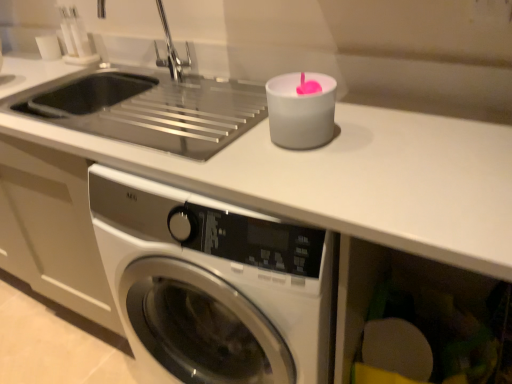
Find the location of a particular element. Image resolution: width=512 pixels, height=384 pixels. silver metallic faucet at upper left is located at coordinates (170, 50).

In order to face matte plastic sponge at lower right, should I rotate leftwards or rightwards?

To align with it, rotate right about 20.956°.

This screenshot has height=384, width=512. I want to click on matte plastic sponge at lower right, so click(x=422, y=315).

At what (x,y) coordinates should I click in order to perform the action: click on white matte candle at upper right. Please return your answer as a coordinate pair (x, y). Image resolution: width=512 pixels, height=384 pixels. Looking at the image, I should click on (301, 109).

Is matte plastic sponge at lower right far from white matte candle at upper right?

No, there isn't a large distance between matte plastic sponge at lower right and white matte candle at upper right.

Where is `candle holder above the matte plastic sponge at lower right (from a real-world perspective)`? This screenshot has height=384, width=512. candle holder above the matte plastic sponge at lower right (from a real-world perspective) is located at coordinates (301, 109).

Does point (339, 348) appear closer or farther from the camera than point (288, 134)?

Clearly, point (339, 348) is more distant from the camera than point (288, 134).

From the image's perspective, is white matte candle at upper right under matte plastic sponge at lower right?

No, from the image's perspective, white matte candle at upper right is not below matte plastic sponge at lower right.

Choose the correct answer: Is white matte candle at upper right inside matte plastic sponge at lower right or outside it?

white matte candle at upper right exists outside the volume of matte plastic sponge at lower right.

Which object is thinner, white matte candle at upper right or matte plastic sponge at lower right?

Thinner between the two is white matte candle at upper right.

Which is closer to the camera, (328,103) or (448,370)?

The point (328,103) is closer.

Is silver metallic faucet at upper left far away from matte plastic sponge at lower right?

Yes.

Is matte plastic sponge at lower right at the back of silver metallic faucet at upper left?

silver metallic faucet at upper left is not turned away from matte plastic sponge at lower right.

In the scene shown: Which is correct: silver metallic faucet at upper left is inside matte plastic sponge at lower right, or outside of it?

silver metallic faucet at upper left exists outside the volume of matte plastic sponge at lower right.

Is silver metallic faucet at upper left wider or thinner than matte plastic sponge at lower right?

Clearly, silver metallic faucet at upper left has less width compared to matte plastic sponge at lower right.

How much distance is there between white matte candle at upper right and silver metallic faucet at upper left?

white matte candle at upper right and silver metallic faucet at upper left are 26.37 inches apart from each other.

Which object is closer to the camera taking this photo, white matte candle at upper right or silver metallic faucet at upper left?

white matte candle at upper right is in front.

This screenshot has width=512, height=384. In order to click on faucet above the white matte candle at upper right (from the image's perspective) in this screenshot , I will do `click(170, 50)`.

Is white matte counter top at upper center outside of white matte candle at upper right?

Yes.

Considering the relative sizes of white matte counter top at upper center and white matte candle at upper right in the image provided, is white matte counter top at upper center bigger than white matte candle at upper right?

Correct, white matte counter top at upper center is larger in size than white matte candle at upper right.

Is white matte counter top at upper center not near white matte candle at upper right?

No, there isn't a large distance between white matte counter top at upper center and white matte candle at upper right.

Measure the distance from white matte counter top at upper center to white matte candle at upper right.

A distance of 6.93 inches exists between white matte counter top at upper center and white matte candle at upper right.

From a real-world perspective, between matte plastic sponge at lower right and silver metallic faucet at upper left, who is vertically lower?

In real-world perspective, matte plastic sponge at lower right is lower.

Considering their positions, is matte plastic sponge at lower right located in front of or behind silver metallic faucet at upper left?

matte plastic sponge at lower right is positioned closer to the viewer than silver metallic faucet at upper left.

In terms of width, does matte plastic sponge at lower right look wider or thinner when compared to silver metallic faucet at upper left?

In the image, matte plastic sponge at lower right appears to be wider than silver metallic faucet at upper left.

Does matte plastic sponge at lower right touch silver metallic faucet at upper left?

No.

Is the position of white matte counter top at upper center less distant than that of matte plastic sponge at lower right?

Yes, white matte counter top at upper center is closer to the viewer.

Based on the photo, can you confirm if white matte counter top at upper center is positioned to the left of matte plastic sponge at lower right?

Correct, you'll find white matte counter top at upper center to the left of matte plastic sponge at lower right.

From a real-world perspective, is white matte counter top at upper center physically above matte plastic sponge at lower right?

Yes, from a real-world perspective, white matte counter top at upper center is on top of matte plastic sponge at lower right.

Locate an element on the screen. The width and height of the screenshot is (512, 384). candle holder above the matte plastic sponge at lower right (from a real-world perspective) is located at coordinates (301, 109).

Identify the location of drawer below the white matte candle at upper right (from a real-world perspective). (422, 315).

Estimate the real-world distances between objects in this image. Which object is closer to white matte counter top at upper center, matte plastic sponge at lower right or white matte candle at upper right?

white matte candle at upper right lies closer to white matte counter top at upper center than the other object.

When comparing their distances from matte plastic sponge at lower right, does white matte counter top at upper center or white matte candle at upper right seem closer?

The object closer to matte plastic sponge at lower right is white matte counter top at upper center.

Considering their positions, is silver metallic faucet at upper left positioned further to white matte counter top at upper center than white matte candle at upper right?

silver metallic faucet at upper left is further to white matte counter top at upper center.

Consider the image. From the image, which object appears to be nearer to silver metallic faucet at upper left, white matte candle at upper right or white matte counter top at upper center?

white matte candle at upper right.

From the image, which object appears to be farther from silver metallic faucet at upper left, matte plastic sponge at lower right or white matte candle at upper right?

The object further to silver metallic faucet at upper left is matte plastic sponge at lower right.

Which object lies nearer to the anchor point matte plastic sponge at lower right, white matte candle at upper right or silver metallic faucet at upper left?

The object closer to matte plastic sponge at lower right is white matte candle at upper right.

From the image, which object appears to be farther from silver metallic faucet at upper left, white matte counter top at upper center or matte plastic sponge at lower right?

Among the two, matte plastic sponge at lower right is located further to silver metallic faucet at upper left.

Looking at the image, which one is located further to white matte candle at upper right, silver metallic faucet at upper left or matte plastic sponge at lower right?

silver metallic faucet at upper left is positioned further to the anchor white matte candle at upper right.

The height and width of the screenshot is (384, 512). Identify the location of candle holder between silver metallic faucet at upper left and matte plastic sponge at lower right in the up-down direction. (301, 109).

Image resolution: width=512 pixels, height=384 pixels. Identify the location of counter top between silver metallic faucet at upper left and matte plastic sponge at lower right vertically. (349, 179).

At what (x,y) coordinates should I click in order to perform the action: click on counter top between white matte candle at upper right and matte plastic sponge at lower right in the up-down direction. Please return your answer as a coordinate pair (x, y). Looking at the image, I should click on (349, 179).

At what (x,y) coordinates should I click in order to perform the action: click on candle holder between silver metallic faucet at upper left and white matte counter top at upper center in the vertical direction. Please return your answer as a coordinate pair (x, y). This screenshot has width=512, height=384. Looking at the image, I should click on (301, 109).